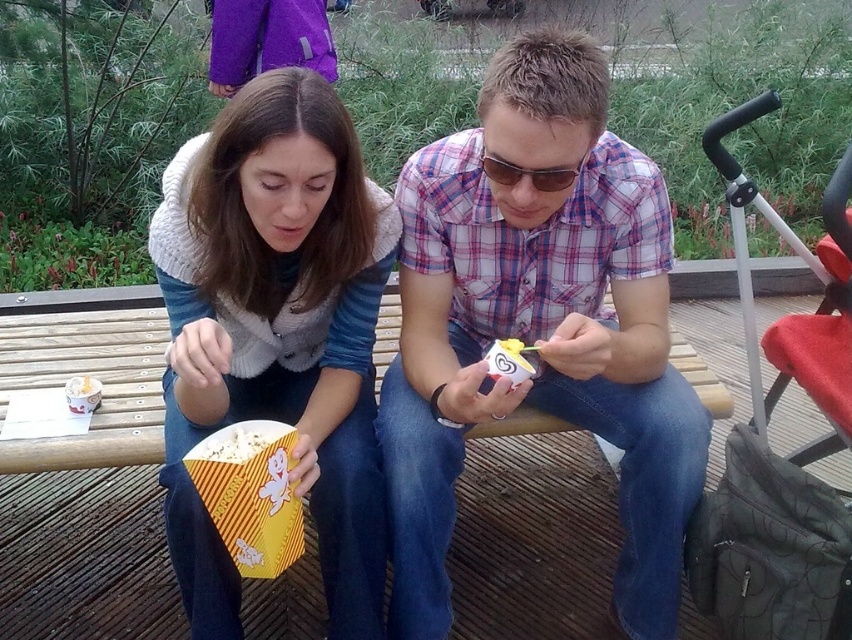
Question: Considering the relative positions of plaid shirt at center and yellow paper popcorn at lower center in the image provided, where is plaid shirt at center located with respect to yellow paper popcorn at lower center?

Choices:
 (A) below
 (B) above

Answer: (B)

Question: Which point is closer to the camera taking this photo?

Choices:
 (A) (206, 317)
 (B) (534, 212)
 (C) (217, 458)
 (D) (755, 205)

Answer: (C)

Question: Which of the following is the closest to the observer?

Choices:
 (A) yellow paper popcorn at lower center
 (B) matte yellow popcorn box at center
 (C) plaid shirt at center

Answer: (A)

Question: Which point is farther from the camera taking this photo?

Choices:
 (A) (240, 438)
 (B) (747, 188)

Answer: (B)

Question: Can you confirm if plaid shirt at center is smaller than matte yellow popcorn box at center?

Choices:
 (A) yes
 (B) no

Answer: (B)

Question: From the image, what is the correct spatial relationship of plaid shirt at center in relation to yellow paper popcorn at lower center?

Choices:
 (A) left
 (B) right

Answer: (B)